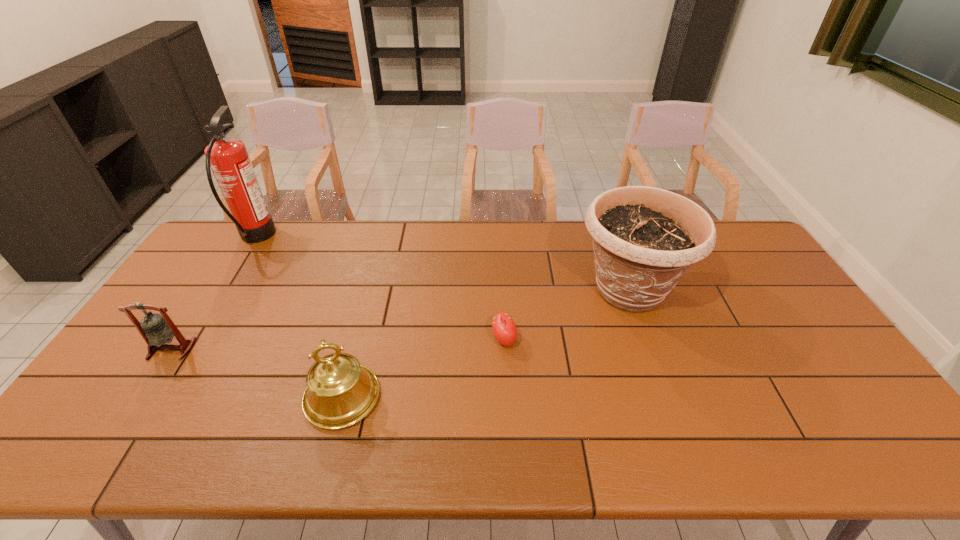
Find the location of `free space that satisfies the following two spatial constraints: 1. on the front-facing side of the tallest object; 2. on the left side of the fourth shortest object`. free space that satisfies the following two spatial constraints: 1. on the front-facing side of the tallest object; 2. on the left side of the fourth shortest object is located at coordinates (223, 290).

Where is `free spot that satisfies the following two spatial constraints: 1. on the front-facing side of the tallest object; 2. on the front side of the shorter bell`? Image resolution: width=960 pixels, height=540 pixels. free spot that satisfies the following two spatial constraints: 1. on the front-facing side of the tallest object; 2. on the front side of the shorter bell is located at coordinates (186, 349).